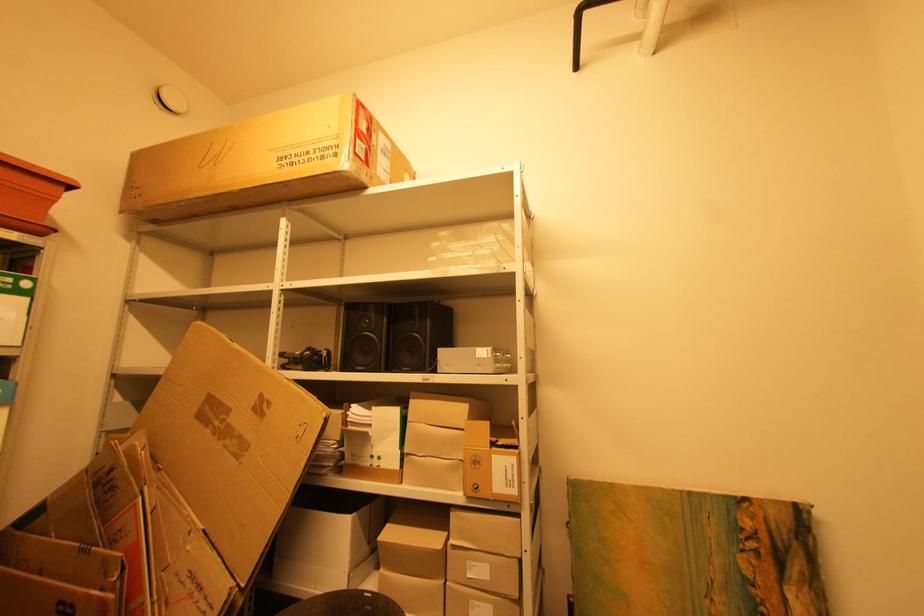
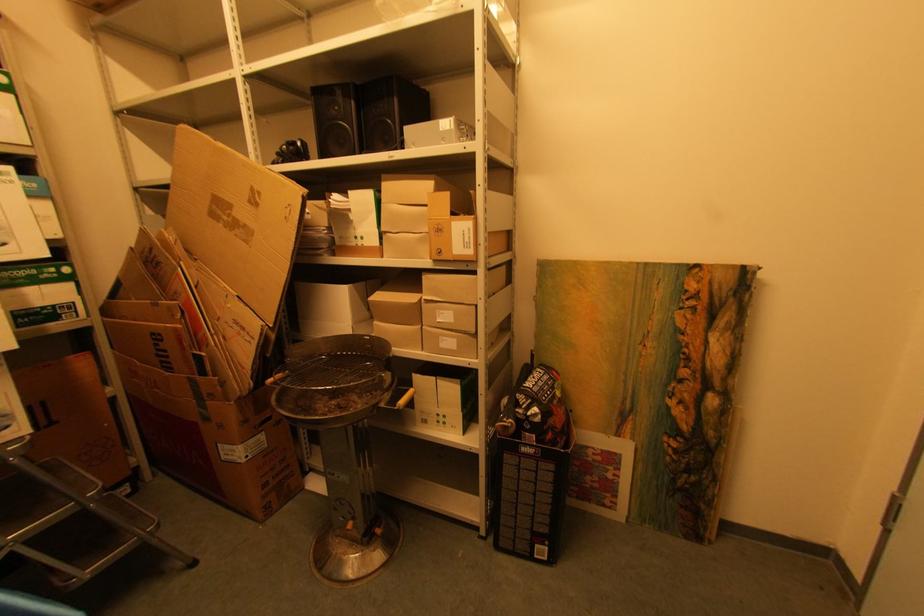
Question: The first image is from the beginning of the video and the second image is from the end. How did the camera likely rotate when shooting the video?

Choices:
 (A) Left
 (B) Right
 (C) Up
 (D) Down

Answer: (D)